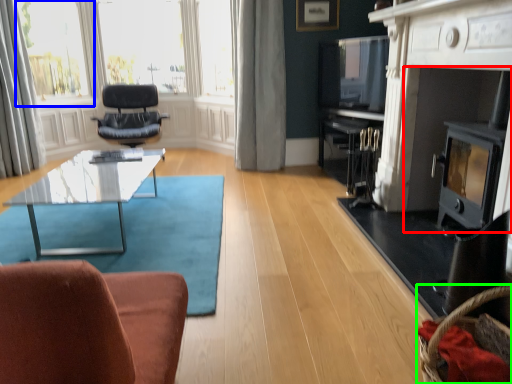
Question: Which object is the closest to the fireplace (highlighted by a red box)? Choose among these: bay window (highlighted by a blue box) or basket (highlighted by a green box).

Choices:
 (A) bay window
 (B) basket

Answer: (B)